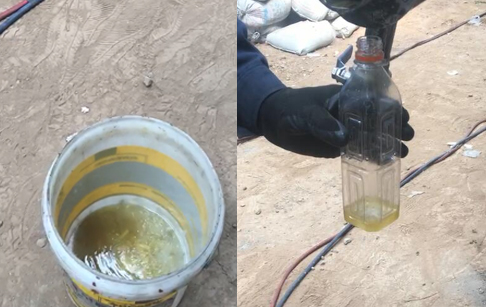
The image size is (486, 307). I want to click on bucket, so click(x=127, y=136).